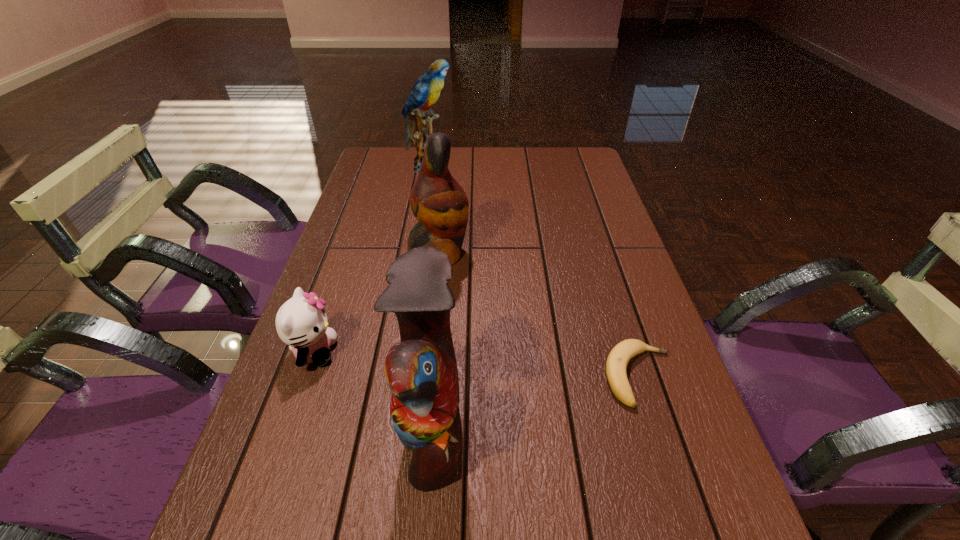
The height and width of the screenshot is (540, 960). In order to click on vacant space at the far right corner in this screenshot , I will do `click(589, 171)`.

At what (x,y) coordinates should I click in order to perform the action: click on free spot between the second nearest parrot and the banana. Please return your answer as a coordinate pair (x, y). Looking at the image, I should click on (540, 315).

Where is `blank region between the second shortest object and the nearest parrot`? The width and height of the screenshot is (960, 540). blank region between the second shortest object and the nearest parrot is located at coordinates (373, 389).

Locate an element on the screen. empty location between the shortest object and the fourth nearest object is located at coordinates (540, 315).

At what (x,y) coordinates should I click in order to perform the action: click on vacant area that lies between the leftmost object and the shortest object. Please return your answer as a coordinate pair (x, y). The image size is (960, 540). Looking at the image, I should click on (477, 364).

Choose which object is the third nearest neighbor to the nearest parrot. Please provide its 2D coordinates. Your answer should be formatted as a tuple, i.e. [(x, y)], where the tuple contains the x and y coordinates of a point satisfying the conditions above.

[(439, 203)]

Locate an element on the screen. object that ranks as the fourth closest to the fourth tallest object is located at coordinates (426, 91).

Choose which parrot is the second nearest neighbor to the farthest object. Please provide its 2D coordinates. Your answer should be formatted as a tuple, i.e. [(x, y)], where the tuple contains the x and y coordinates of a point satisfying the conditions above.

[(421, 371)]

I want to click on the second closest parrot to the farthest parrot, so click(x=421, y=371).

You are a GUI agent. You are given a task and a screenshot of the screen. Output one action in this format:
    pyautogui.click(x=<x>, y=<y>)
    Task: Click on the vacant space that satisfies the following two spatial constraints: 1. on the back side of the banana; 2. on the face of the farthest parrot
    
    Given the screenshot: What is the action you would take?
    pyautogui.click(x=572, y=166)